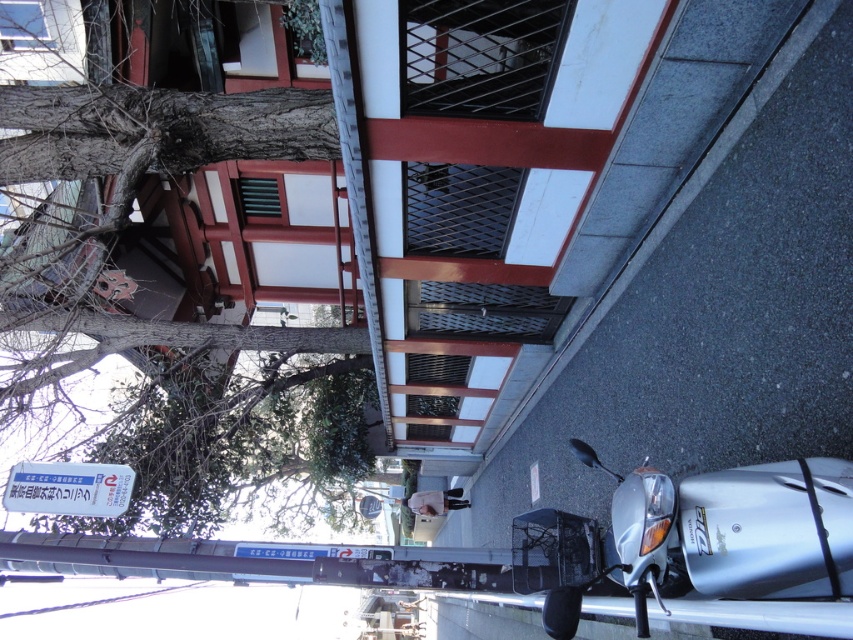
Question: Which point is farther to the camera?

Choices:
 (A) (329, 234)
 (B) (624, 566)

Answer: (A)

Question: Is smooth brown tree trunk at upper left thinner than silver metallic motorcycle at lower right?

Choices:
 (A) no
 (B) yes

Answer: (B)

Question: Which point is closer to the camera?

Choices:
 (A) smooth brown tree trunk at upper left
 (B) silver metallic motorcycle at lower right

Answer: (B)

Question: Is smooth brown tree trunk at upper left closer to the viewer compared to silver metallic motorcycle at lower right?

Choices:
 (A) yes
 (B) no

Answer: (B)

Question: Which object is closer to the camera taking this photo?

Choices:
 (A) smooth brown tree trunk at upper left
 (B) silver metallic motorcycle at lower right

Answer: (B)

Question: Is smooth brown tree trunk at upper left closer to the viewer compared to silver metallic motorcycle at lower right?

Choices:
 (A) no
 (B) yes

Answer: (A)